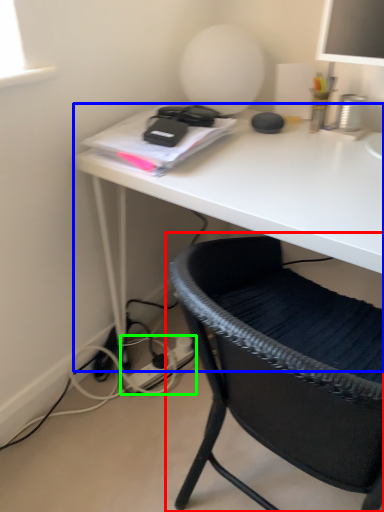
Question: Considering the real-world distances, which object is closest to chair (highlighted by a red box)? desk (highlighted by a blue box) or plug (highlighted by a green box).

Choices:
 (A) desk
 (B) plug

Answer: (A)